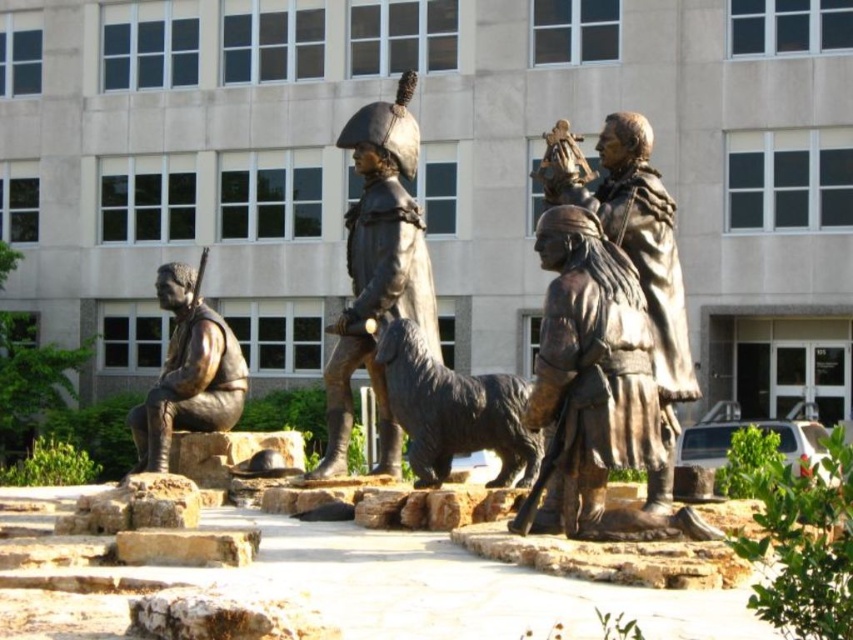
Question: Does shiny bronze dog at center lie behind bronze statue at left?

Choices:
 (A) yes
 (B) no

Answer: (B)

Question: Is shiny bronze dog at center further to camera compared to bronze statue at left?

Choices:
 (A) yes
 (B) no

Answer: (B)

Question: Among these objects, which one is nearest to the camera?

Choices:
 (A) bronze statue at left
 (B) shiny bronze dog at center
 (C) bronze statue at center

Answer: (B)

Question: Which object is positioned farthest from the shiny bronze dog at center?

Choices:
 (A) bronze statue at left
 (B) bronze statue at center

Answer: (A)

Question: Which is farther from the shiny bronze dog at center?

Choices:
 (A) bronze statue at left
 (B) bronze statue at center

Answer: (A)

Question: Does bronze statue at center come behind bronze statue at left?

Choices:
 (A) no
 (B) yes

Answer: (A)